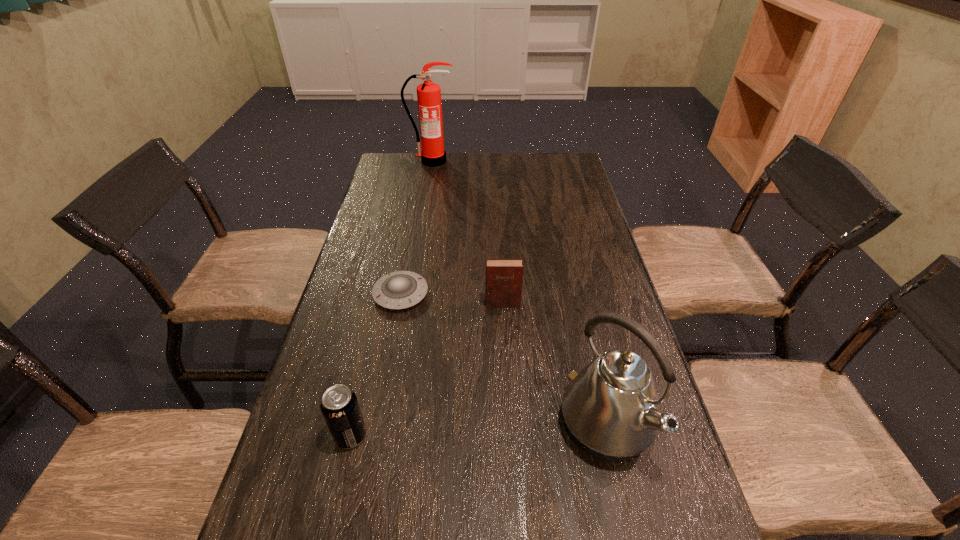
Locate an element on the screen. This screenshot has width=960, height=540. empty space that is in between the diary and the saucer is located at coordinates tap(451, 299).

The height and width of the screenshot is (540, 960). I want to click on object identified as the closest to the soda can, so click(x=397, y=290).

Locate an element on the screen. object that is the fourth closest one to the soda can is located at coordinates (433, 154).

The width and height of the screenshot is (960, 540). In order to click on vacant space that satisfies the following two spatial constraints: 1. with the nozzle aimed from the farthest object; 2. on the right side of the second tallest object in this screenshot , I will do `click(388, 426)`.

What are the coordinates of `free space that satisfies the following two spatial constraints: 1. with the nozzle aimed from the farthest object; 2. on the right side of the rightmost object` in the screenshot? It's located at (388, 426).

I want to click on blank area in the image that satisfies the following two spatial constraints: 1. with the nozzle aimed from the kettle; 2. on the right side of the fire extinguisher, so click(388, 426).

Where is `free space that satisfies the following two spatial constraints: 1. on the front cover of the second object from right to left; 2. on the right side of the fourth shortest object`? The image size is (960, 540). free space that satisfies the following two spatial constraints: 1. on the front cover of the second object from right to left; 2. on the right side of the fourth shortest object is located at coordinates (509, 426).